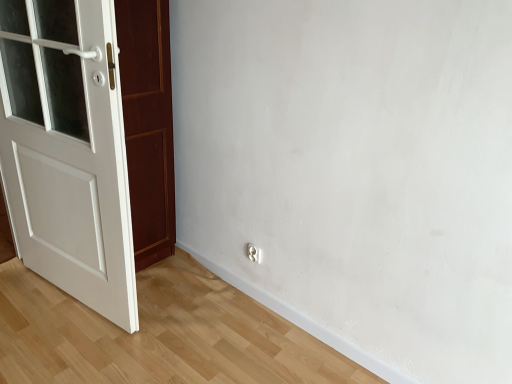
Locate an element on the screen. space that is in front of white painted wood door at left is located at coordinates (56, 341).